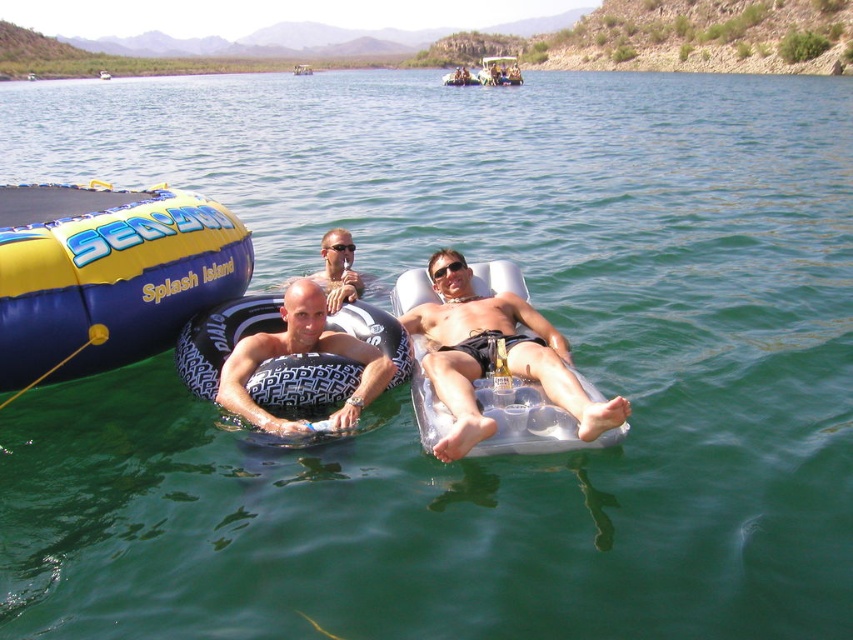
You are taking a photo of the scene and want to focus on both the point at point [495,54] and point [312,68]. Which point is closer to the camera?

Point [312,68] is closer to the camera than point [495,54].

You are planning to bring a small cooler to the lake. You see the metallic silver raft at center and the blue inflatable raft at center. Which raft can you place the cooler on without it falling over?

The metallic silver raft at center is much taller than the blue inflatable raft at center, so the cooler would be more stable on the metallic silver raft at center.

You are a photographer planning to take a group photo of the metallic silver raft at center and the other people in the water. If your camera has a maximum focus range of 400 feet, will you be able to capture all subjects in focus?

The metallic silver raft at center and the other people in the water are 416.07 feet apart. Since the camera can only focus up to 400 feet, it won not be able to capture all subjects in focus.